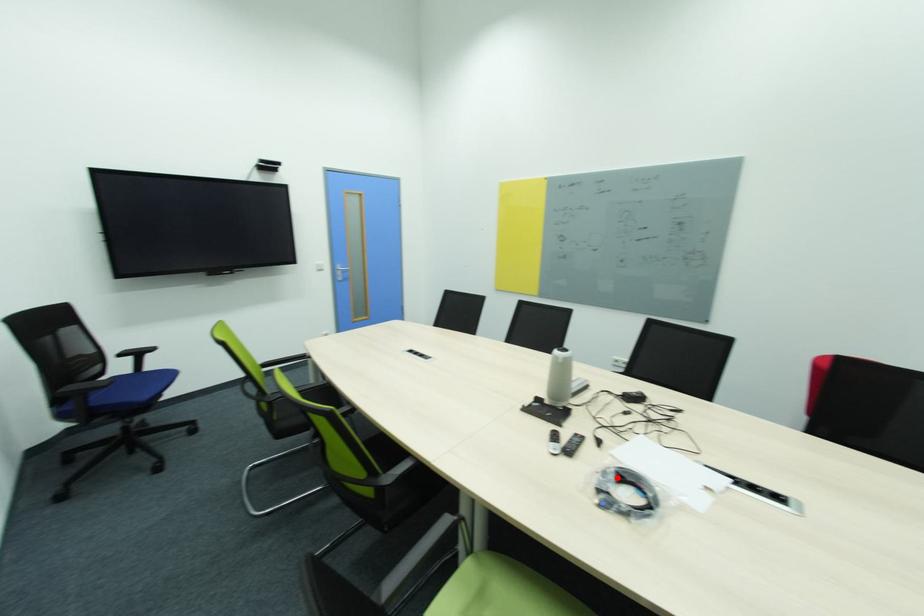
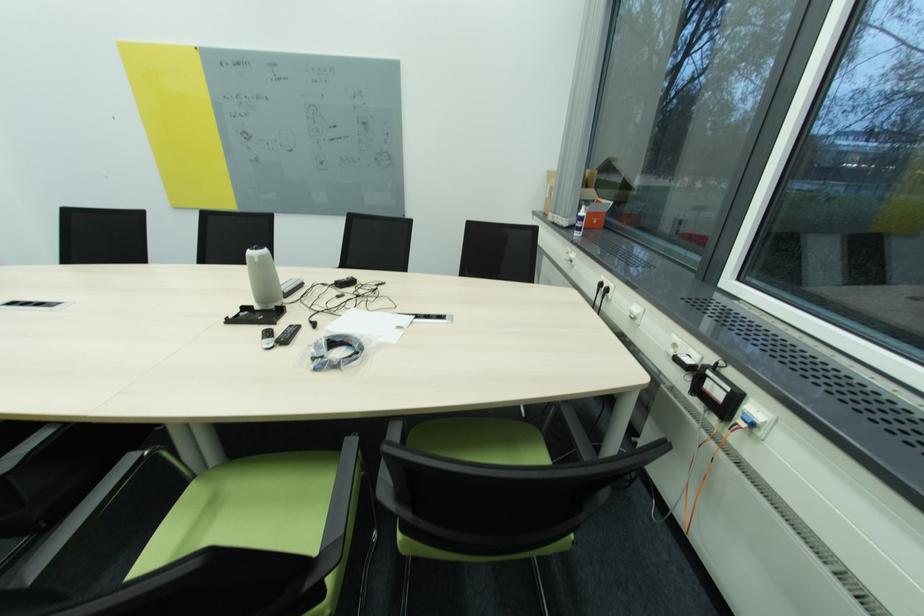
The point at the highlighted location is marked in the first image. Where is the corresponding point in the second image?

(327, 345)